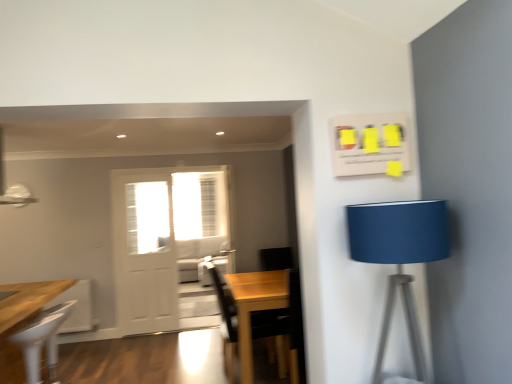
Identify the location of white plastic chair at lower left. (42, 341).

Measure the distance between wooden table at center and camera.

wooden table at center and camera are 3.57 meters apart.

What do you see at coordinates (399, 255) in the screenshot? I see `blue fabric lampshade at right` at bounding box center [399, 255].

Where is `white plastic chair at lower left`? white plastic chair at lower left is located at coordinates (42, 341).

Are wooden table at center and white glossy screen door at center beside each other?

No, wooden table at center is not touching white glossy screen door at center.

Could you tell me if wooden table at center is turned towards white glossy screen door at center?

No, wooden table at center is not turned towards white glossy screen door at center.

What's the angular difference between wooden table at center and white glossy screen door at center's facing directions?

The angle between the facing direction of wooden table at center and the facing direction of white glossy screen door at center is 92.8 degrees.

From the image's perspective, between blue fabric lampshade at right and wooden table at center, who is located below?

From the image's view, wooden table at center is below.

Could you tell me if blue fabric lampshade at right is facing wooden table at center?

No, blue fabric lampshade at right is not oriented towards wooden table at center.

Is blue fabric lampshade at right behind wooden table at center?

No, blue fabric lampshade at right is in front of wooden table at center.

Considering the positions of objects blue fabric lampshade at right and white glossy screen door at center in the image provided, who is more to the left, blue fabric lampshade at right or white glossy screen door at center?

white glossy screen door at center is more to the left.

Who is more distant, blue fabric lampshade at right or white glossy screen door at center?

Positioned behind is white glossy screen door at center.

In the scene shown: From the image's perspective, is blue fabric lampshade at right located above white glossy screen door at center?

Indeed, from the image's perspective, blue fabric lampshade at right is shown above white glossy screen door at center.

Is there a large distance between blue fabric lampshade at right and white glossy screen door at center?

blue fabric lampshade at right is positioned a significant distance from white glossy screen door at center.

Locate an element on the screen. The width and height of the screenshot is (512, 384). couch located below the white glossy screen door at center (from the image's perspective) is located at coordinates (199, 255).

Do you think white glossy screen door at center is within light gray fabric couch at center, or outside of it?

white glossy screen door at center is not inside light gray fabric couch at center, it's outside.

From the image's perspective, which is above, white glossy screen door at center or light gray fabric couch at center?

white glossy screen door at center is shown above in the image.

Which of these two, white glossy screen door at center or light gray fabric couch at center, stands taller?

With more height is white glossy screen door at center.

Find the location of a particular element. table lamp in front of the white sheer curtain at center is located at coordinates (399, 255).

How different are the orientations of white sheer curtain at center and blue fabric lampshade at right in degrees?

white sheer curtain at center and blue fabric lampshade at right are facing 0.307 degrees away from each other.

Could you tell me if white sheer curtain at center is facing blue fabric lampshade at right?

Yes, white sheer curtain at center is turned towards blue fabric lampshade at right.

Between white sheer curtain at center and blue fabric lampshade at right, which one has smaller width?

With smaller width is white sheer curtain at center.

From a real-world perspective, is white sheer curtain at center physically above white plastic chair at lower left?

Yes.

Measure the distance between white sheer curtain at center and white plastic chair at lower left.

2.30 meters.

Where is `curtain above the white plastic chair at lower left (from a real-world perspective)`? curtain above the white plastic chair at lower left (from a real-world perspective) is located at coordinates (208, 204).

Can you confirm if white sheer curtain at center is wider than white plastic chair at lower left?

No, white sheer curtain at center is not wider than white plastic chair at lower left.

Is white matte door at center bigger or smaller than wooden table at center?

white matte door at center is smaller than wooden table at center.

Does point (147, 207) come behind point (253, 286)?

Yes, it is.

Identify the location of door located above the wooden table at center (from a real-world perspective). The width and height of the screenshot is (512, 384). (163, 237).

From a real-world perspective, is white matte door at center over wooden table at center?

Indeed, from a real-world perspective, white matte door at center stands above wooden table at center.

The image size is (512, 384). What are the coordinates of `screen door above the wooden table at center (from the image's perspective)` in the screenshot? It's located at (144, 253).

At what (x,y) coordinates should I click in order to perform the action: click on table lamp above the wooden table at center (from a real-world perspective). Please return your answer as a coordinate pair (x, y). The width and height of the screenshot is (512, 384). Looking at the image, I should click on (399, 255).

When comparing their distances from white glossy screen door at center, does white matte door at center or light gray fabric couch at center seem further?

light gray fabric couch at center lies further to white glossy screen door at center than the other object.

Considering their positions, is white sheer curtain at center positioned closer to white plastic chair at lower left than blue fabric lampshade at right?

white sheer curtain at center is closer to white plastic chair at lower left.

From the image, which object appears to be farther from white glossy screen door at center, light gray fabric couch at center or blue fabric lampshade at right?

blue fabric lampshade at right is positioned further to the anchor white glossy screen door at center.

Considering their positions, is wooden table at center positioned further to white glossy screen door at center than light gray fabric couch at center?

wooden table at center lies further to white glossy screen door at center than the other object.

Looking at the image, which one is located further to white matte door at center, white sheer curtain at center or white glossy screen door at center?

white sheer curtain at center.

Estimate the real-world distances between objects in this image. Which object is closer to white glossy screen door at center, white sheer curtain at center or light gray fabric couch at center?

light gray fabric couch at center is closer to white glossy screen door at center.

When comparing their distances from white sheer curtain at center, does blue fabric lampshade at right or light gray fabric couch at center seem further?

blue fabric lampshade at right is further to white sheer curtain at center.

Estimate the real-world distances between objects in this image. Which object is further from light gray fabric couch at center, white glossy screen door at center or white plastic chair at lower left?

Among the two, white plastic chair at lower left is located further to light gray fabric couch at center.

This screenshot has height=384, width=512. I want to click on screen door positioned between blue fabric lampshade at right and light gray fabric couch at center from near to far, so click(144, 253).

You are a GUI agent. You are given a task and a screenshot of the screen. Output one action in this format:
    pyautogui.click(x=<x>, y=<y>)
    Task: Click on the couch located between blue fabric lampshade at right and white sheer curtain at center in the depth direction
    This screenshot has height=384, width=512.
    Given the screenshot: What is the action you would take?
    pyautogui.click(x=199, y=255)

This screenshot has width=512, height=384. I want to click on couch positioned between white glossy screen door at center and white sheer curtain at center from near to far, so click(199, 255).

What are the coordinates of `door between white plastic chair at lower left and light gray fabric couch at center along the z-axis` in the screenshot? It's located at (163, 237).